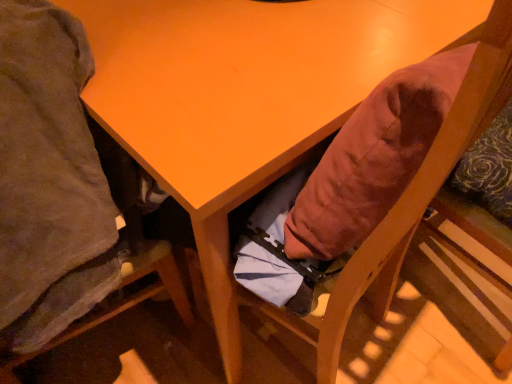
Question: Should I look upward or downward to see wooden chair at lower left, acting as the 2th chair starting from the right?

Choices:
 (A) down
 (B) up

Answer: (A)

Question: From a real-world perspective, does wooden chair at lower left, which appears as the first chair when viewed from the left, sit lower than velvet-like orange cushion at lower right, the 1th chair from the right?

Choices:
 (A) yes
 (B) no

Answer: (A)

Question: Does wooden chair at lower left, acting as the 2th chair starting from the right, appear on the right side of velvet-like orange cushion at lower right, the second chair positioned from the left?

Choices:
 (A) yes
 (B) no

Answer: (B)

Question: Does wooden chair at lower left, acting as the 2th chair starting from the right, have a greater height compared to velvet-like orange cushion at lower right, the 1th chair from the right?

Choices:
 (A) no
 (B) yes

Answer: (B)

Question: Is wooden chair at lower left, which appears as the first chair when viewed from the left, completely or partially outside of velvet-like orange cushion at lower right, the second chair positioned from the left?

Choices:
 (A) no
 (B) yes

Answer: (B)

Question: Would you say velvet-like orange cushion at lower right, the second chair positioned from the left, is part of wooden chair at lower left, acting as the 2th chair starting from the right,'s contents?

Choices:
 (A) yes
 (B) no

Answer: (B)

Question: Is wooden chair at lower left, which appears as the first chair when viewed from the left, closer to the viewer compared to velvet-like orange cushion at lower right, the second chair positioned from the left?

Choices:
 (A) yes
 (B) no

Answer: (A)

Question: Is the position of velvet-like orange cushion at lower right, the 1th chair from the right, more distant than that of wooden chair at lower left, which appears as the first chair when viewed from the left?

Choices:
 (A) yes
 (B) no

Answer: (A)

Question: From a real-world perspective, is velvet-like orange cushion at lower right, the 1th chair from the right, on top of wooden chair at lower left, which appears as the first chair when viewed from the left?

Choices:
 (A) yes
 (B) no

Answer: (A)

Question: Does velvet-like orange cushion at lower right, the 1th chair from the right, have a smaller size compared to wooden chair at lower left, acting as the 2th chair starting from the right?

Choices:
 (A) yes
 (B) no

Answer: (A)

Question: Can you confirm if velvet-like orange cushion at lower right, the second chair positioned from the left, is wider than wooden chair at lower left, acting as the 2th chair starting from the right?

Choices:
 (A) yes
 (B) no

Answer: (B)

Question: Can you confirm if velvet-like orange cushion at lower right, the 1th chair from the right, is thinner than wooden chair at lower left, which appears as the first chair when viewed from the left?

Choices:
 (A) yes
 (B) no

Answer: (A)

Question: Does velvet-like orange cushion at lower right, the second chair positioned from the left, turn towards wooden chair at lower left, acting as the 2th chair starting from the right?

Choices:
 (A) no
 (B) yes

Answer: (A)

Question: From the image's perspective, is wooden chair at lower left, acting as the 2th chair starting from the right, located above or below velvet-like orange cushion at lower right, the second chair positioned from the left?

Choices:
 (A) below
 (B) above

Answer: (A)